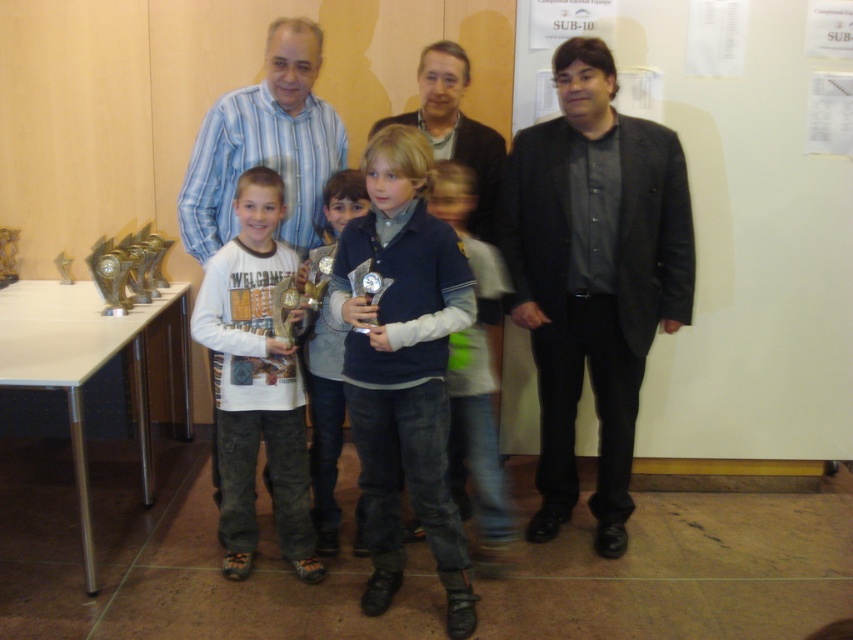
In the scene shown: Does dark blue denim jeans at center have a larger size compared to white cotton shirt at center?

Indeed, dark blue denim jeans at center has a larger size compared to white cotton shirt at center.

Is dark blue denim jeans at center to the left of white cotton shirt at center from the viewer's perspective?

In fact, dark blue denim jeans at center is to the right of white cotton shirt at center.

Where is `dark blue denim jeans at center`? dark blue denim jeans at center is located at coordinates (403, 368).

Can you confirm if dark gray textured blazer at right is positioned to the left of dark blue denim jeans at center?

No, dark gray textured blazer at right is not to the left of dark blue denim jeans at center.

Who is shorter, dark gray textured blazer at right or dark blue denim jeans at center?

Standing shorter between the two is dark blue denim jeans at center.

Identify the location of dark gray textured blazer at right. This screenshot has height=640, width=853. (593, 275).

Consider the image. Which is more to the right, dark blue denim jeans at center or matte black jacket at center?

From the viewer's perspective, dark blue denim jeans at center appears more on the right side.

Is dark blue denim jeans at center thinner than matte black jacket at center?

Yes, dark blue denim jeans at center is thinner than matte black jacket at center.

Between point (398, 536) and point (506, 51), which one is positioned in front?

Positioned in front is point (398, 536).

You are a GUI agent. You are given a task and a screenshot of the screen. Output one action in this format:
    pyautogui.click(x=<x>, y=<y>)
    Task: Click on the dark blue denim jeans at center
    
    Given the screenshot: What is the action you would take?
    pyautogui.click(x=403, y=368)